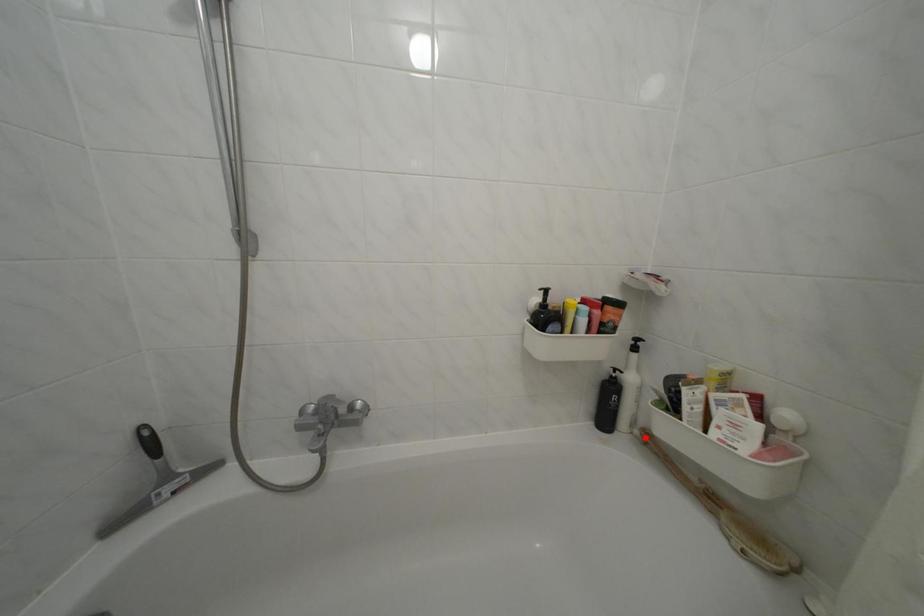
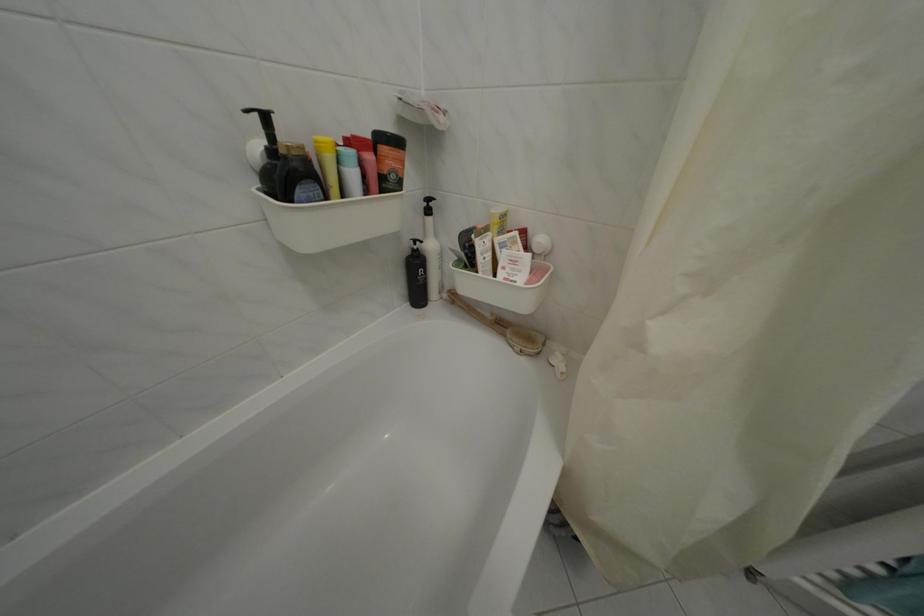
Question: I am providing you with two images of the same scene from different viewpoints. Image1 has a red point marked. In image2, the corresponding 3D location appears at what relative position? Reply with the corresponding letter.

Choices:
 (A) Closer
 (B) Farther

Answer: (A)